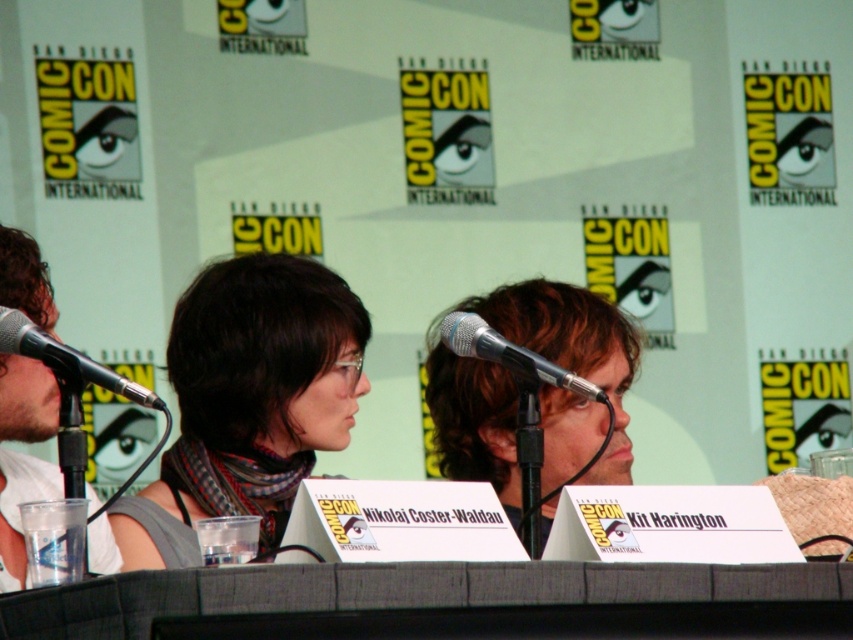
Is matte black scarf at center wider than light brown hair at center?

No, matte black scarf at center is not wider than light brown hair at center.

The image size is (853, 640). I want to click on matte black scarf at center, so click(x=247, y=401).

Describe the element at coordinates (572, 348) in the screenshot. I see `light brown hair at center` at that location.

Where is `light brown hair at center`? The height and width of the screenshot is (640, 853). light brown hair at center is located at coordinates (572, 348).

Is point (618, 340) positioned after point (80, 364)?

Yes.

Identify the location of light brown hair at center. (572, 348).

Which is in front, point (19, 300) or point (1, 310)?

Point (1, 310) is in front.

Which of these two, white matte shirt at left or black metallic microphone at left, stands taller?

Standing taller between the two is white matte shirt at left.

Is point (13, 288) in front of point (68, 348)?

No, it is behind (68, 348).

Where is `white matte shirt at left`? white matte shirt at left is located at coordinates (16, 508).